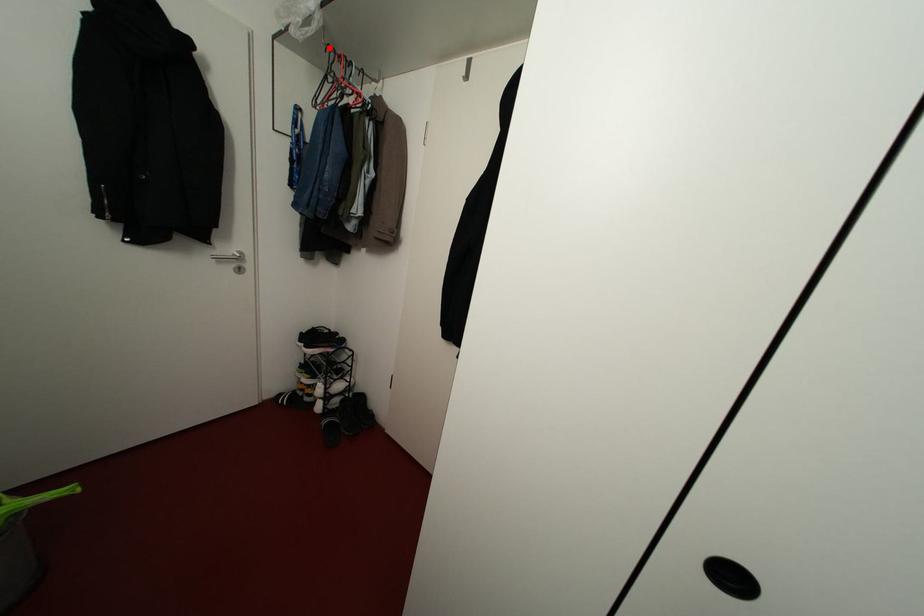
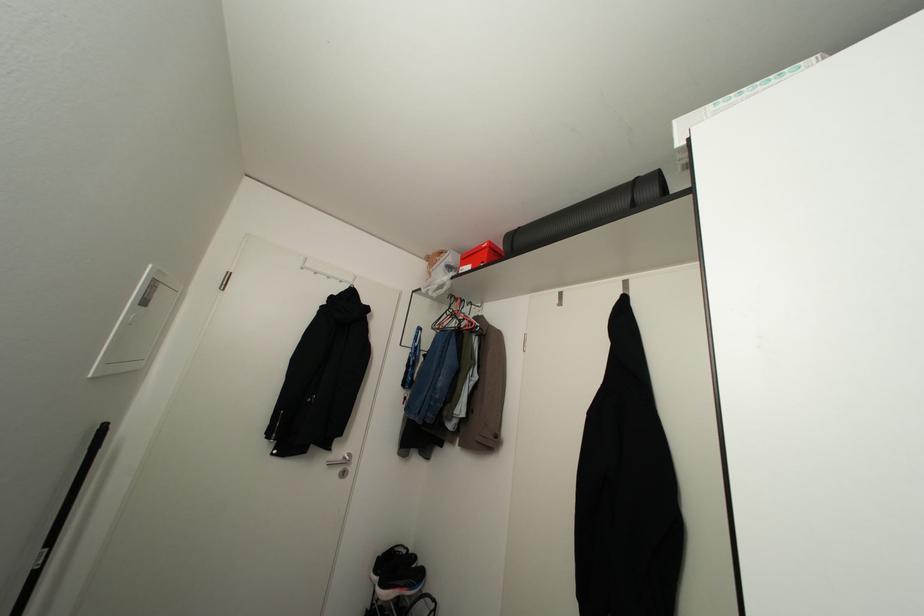
Find the pixel in the second image that matches the highlighted location in the first image.

(451, 294)